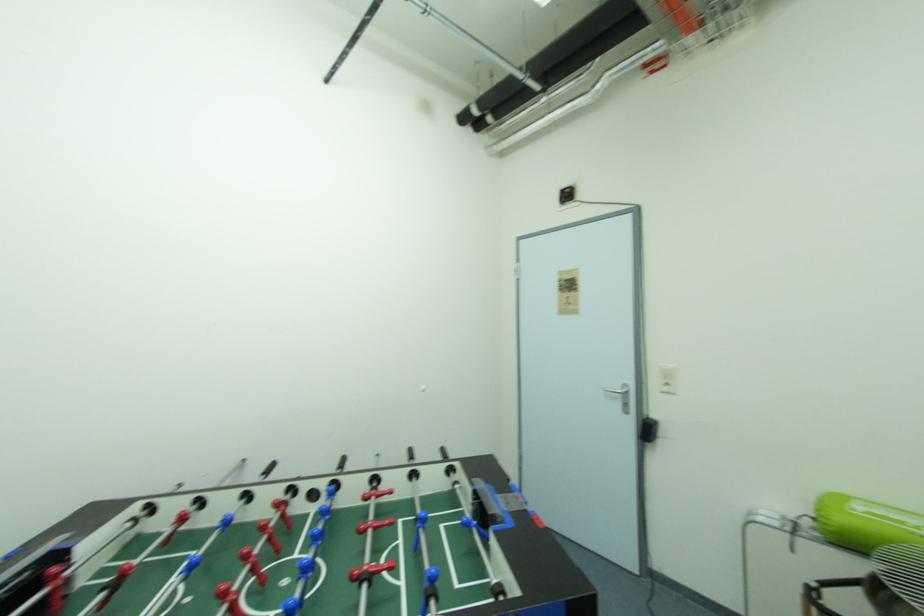
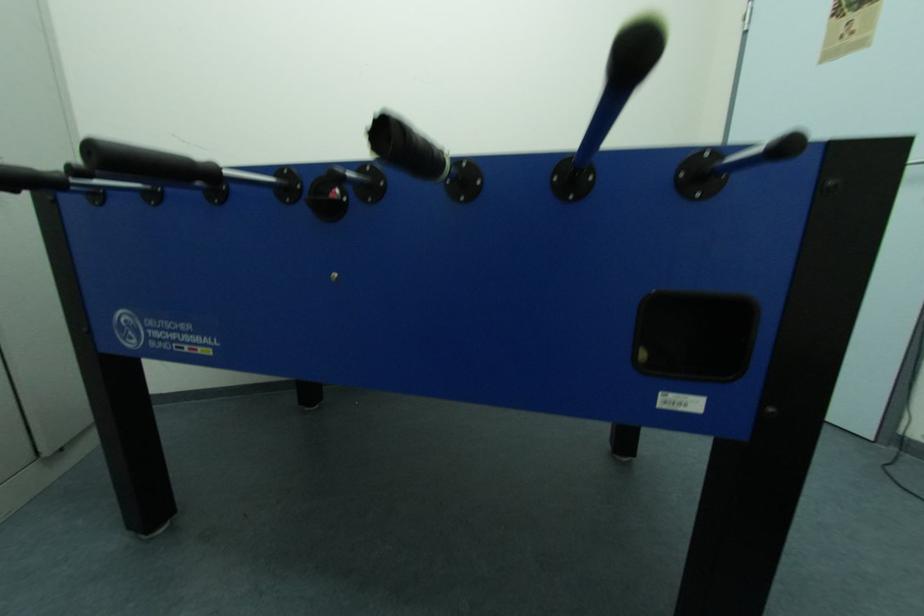
The first image is from the beginning of the video and the second image is from the end. How did the camera likely rotate when shooting the video?

The camera rotated toward left-down.